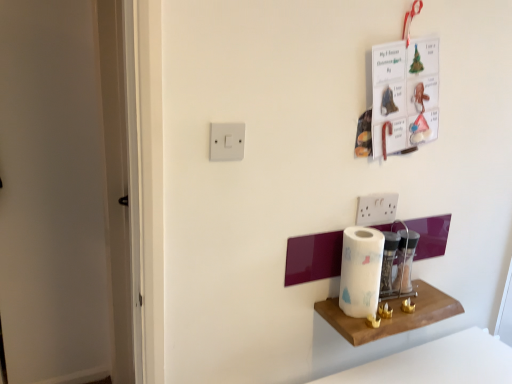
Question: Does point (242, 145) appear closer or farther from the camera than point (392, 319)?

Choices:
 (A) closer
 (B) farther

Answer: (A)

Question: In terms of height, does white plastic light switch at upper center look taller or shorter compared to wooden shelf at lower right?

Choices:
 (A) short
 (B) tall

Answer: (B)

Question: Which of these objects is positioned farthest from the white paper at center?

Choices:
 (A) wooden shelf at lower right
 (B) white plastic light switch at upper center

Answer: (B)

Question: Based on their relative distances, which object is farther from the white plastic light switch at upper center?

Choices:
 (A) white paper at center
 (B) wooden shelf at lower right

Answer: (B)